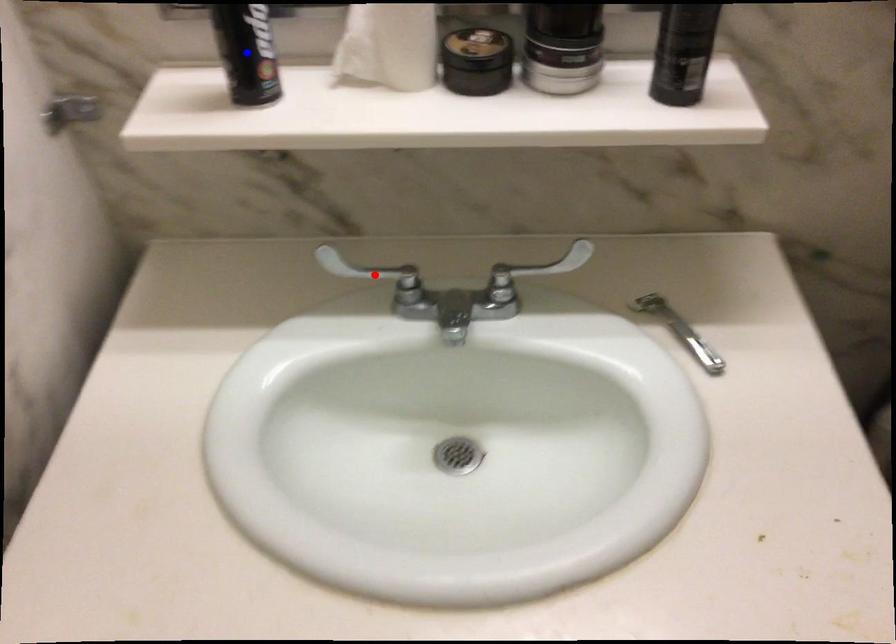
Question: In the image, two points are highlighted. Which point is nearer to the camera? Reply with the corresponding letter.

Choices:
 (A) blue point
 (B) red point

Answer: (A)